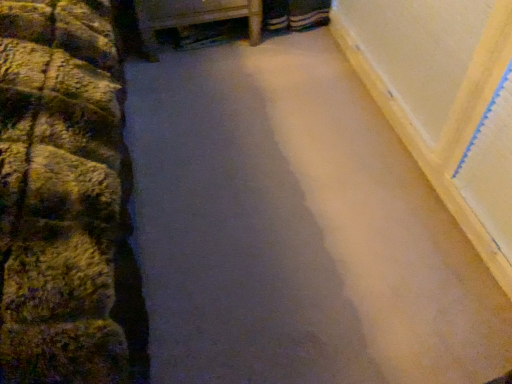
Find the location of a particular element. The image size is (512, 384). empty space that is to the right of wooden bed frame at upper center is located at coordinates (298, 52).